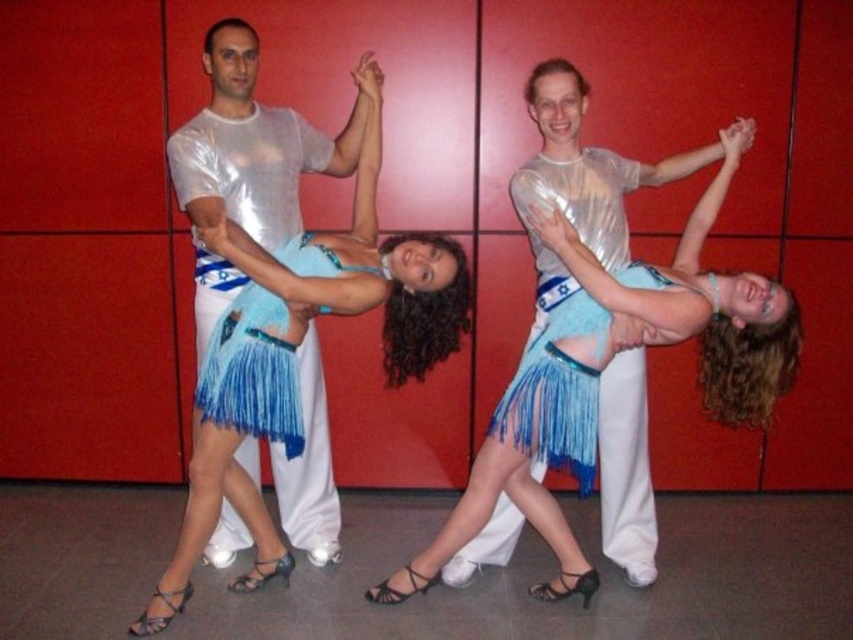
You are a costume designer reviewing the synchronized dance formation. You notice the shiny blue skirt at center and the shiny metallic shirt at center. Which clothing item has a shorter length?

The shiny blue skirt at center is shorter than the shiny metallic shirt at center.

You are a costume designer preparing for a dance performance. You have two skirts available for the lead dancer. The shiny blue skirt at center and the fringed blue fabric skirt at center. Which one would you choose if you want a more eye catching option based on their size?

The shiny blue skirt at center is larger in size than the fringed blue fabric skirt at center, so it would be more eye catching due to its larger size.